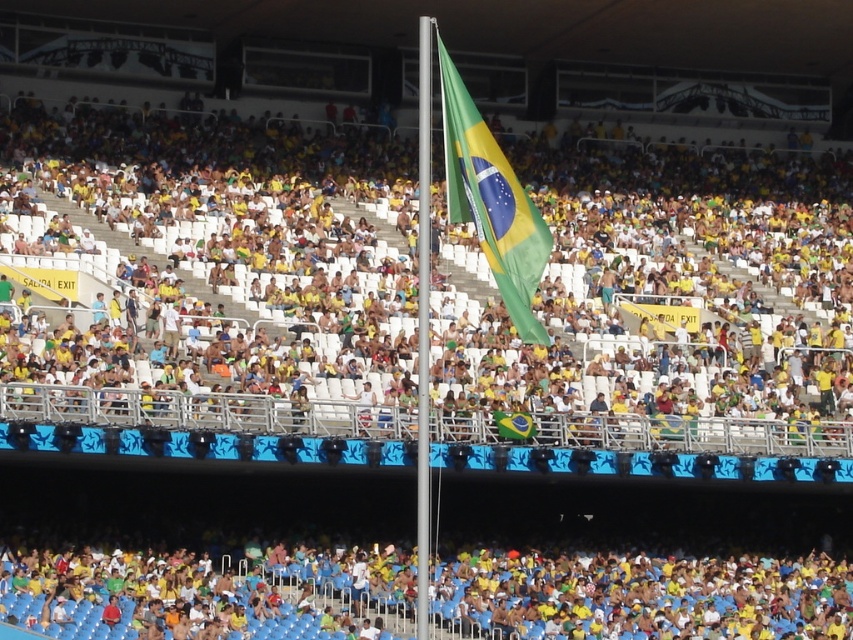
Does yellow fabric crowd at center have a lesser height compared to yellow fabric flag at center?

No, yellow fabric crowd at center is not shorter than yellow fabric flag at center.

Is yellow fabric crowd at center bigger than yellow fabric flag at center?

Yes, yellow fabric crowd at center is bigger than yellow fabric flag at center.

This screenshot has height=640, width=853. In order to click on yellow fabric crowd at center in this screenshot , I will do `click(212, 300)`.

Measure the distance between yellow fabric flag at center and green fabric flag at center.

They are 73.51 feet apart.

Is yellow fabric flag at center taller than green fabric flag at center?

No.

Is point (399, 624) positioned in front of point (473, 108)?

No.

The image size is (853, 640). Find the location of `yellow fabric flag at center`. yellow fabric flag at center is located at coordinates [x=209, y=593].

Between yellow fabric crowd at center and green fabric flag at center, which one appears on the right side from the viewer's perspective?

From the viewer's perspective, green fabric flag at center appears more on the right side.

Between point (195, 257) and point (537, 253), which one is positioned in front?

Point (537, 253)

Image resolution: width=853 pixels, height=640 pixels. Find the location of `yellow fabric crowd at center`. yellow fabric crowd at center is located at coordinates (212, 300).